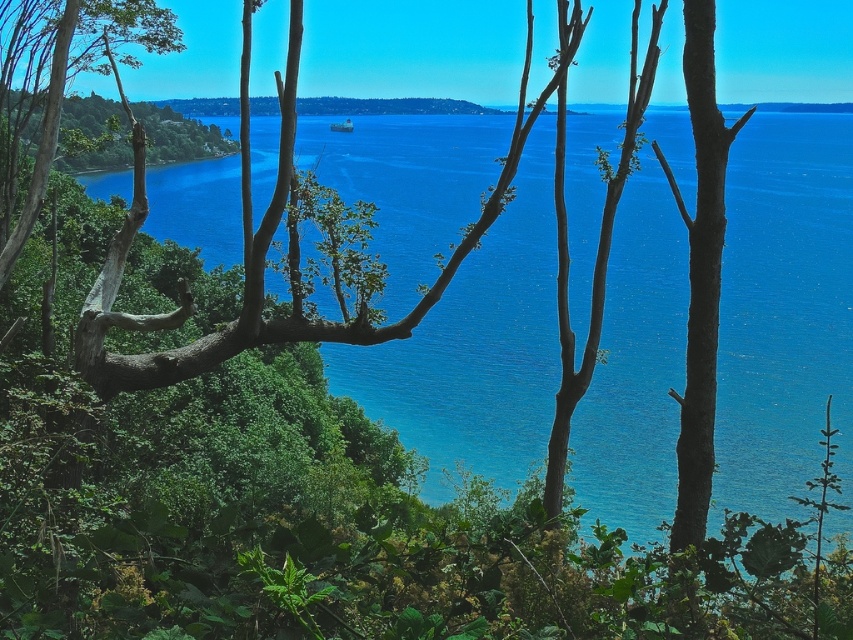
You are standing in a forest looking through the branches of the brown rough bark tree at right. You want to take a photo of the small ship in the distance. Will the tree block your view of the ship?

The brown rough bark tree at right is 5.19 meters from viewer, so it will block your view of the ship unless you move further back or to the side.

You are standing in the forest looking at the coastal landscape. You see the brown rough bark tree at right and the green leafy tree at left. Which tree is closer to the ground?

The brown rough bark tree at right is positioned under the green leafy tree at left, so it is closer to the ground.

You are standing in a forest clearing and see the blue water at center and the green leafy tree at left. Which object appears taller in the scene?

The blue water at center appears taller than the green leafy tree at left in the scene.